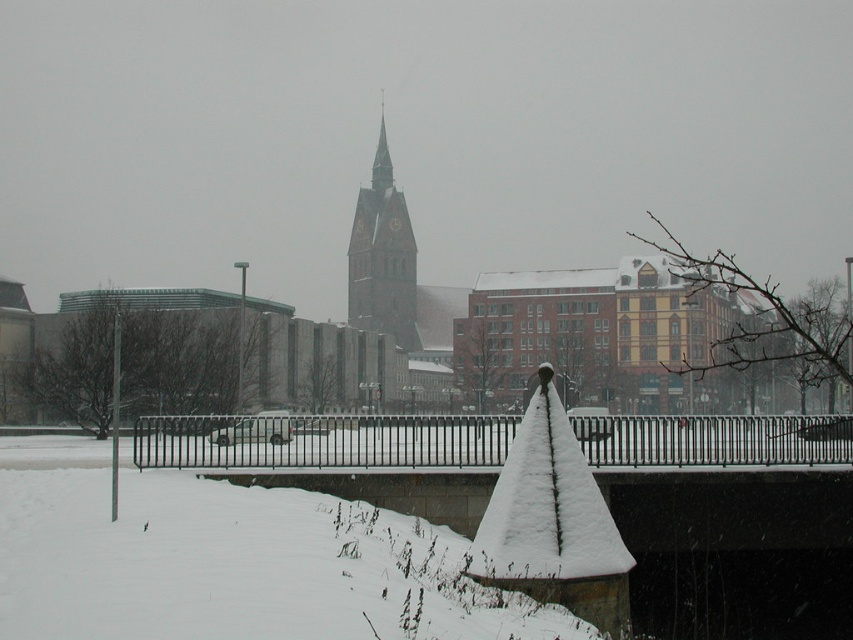
Consider the image. Does black metal fence at center appear under brown stone clock tower at center?

Yes.

Who is more distant from viewer, (801,436) or (372,170)?

Point (372,170)

Which is behind, point (743, 524) or point (384, 184)?

The point (384, 184) is more distant.

The image size is (853, 640). I want to click on black metal fence at center, so click(x=724, y=480).